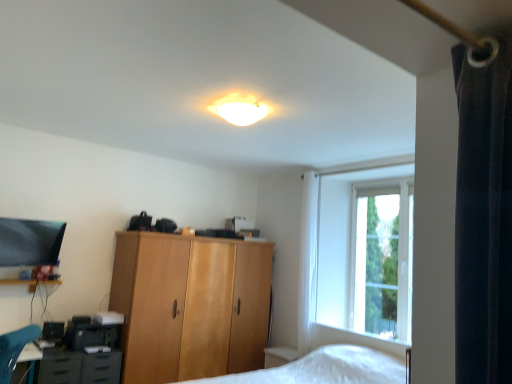
Question: Should I look upward or downward to see matte brown cabinet at lower left?

Choices:
 (A) down
 (B) up

Answer: (A)

Question: From the image's perspective, is matte black drawer at lower left on top of clear glass window at upper right?

Choices:
 (A) no
 (B) yes

Answer: (A)

Question: Is matte black drawer at lower left positioned behind clear glass window at upper right?

Choices:
 (A) no
 (B) yes

Answer: (A)

Question: Is matte black drawer at lower left closer to camera compared to clear glass window at upper right?

Choices:
 (A) no
 (B) yes

Answer: (B)

Question: Considering the relative sizes of matte black drawer at lower left and clear glass window at upper right in the image provided, is matte black drawer at lower left wider than clear glass window at upper right?

Choices:
 (A) no
 (B) yes

Answer: (B)

Question: Is clear glass window at upper right completely or partially inside matte black drawer at lower left?

Choices:
 (A) yes
 (B) no

Answer: (B)

Question: Is matte black drawer at lower left completely or partially outside of clear glass window at upper right?

Choices:
 (A) no
 (B) yes

Answer: (B)

Question: Is wooden cabinet at center at the left side of white fabric curtain at center?

Choices:
 (A) yes
 (B) no

Answer: (A)

Question: Is wooden cabinet at center outside of white fabric curtain at center?

Choices:
 (A) yes
 (B) no

Answer: (A)

Question: From the image's perspective, would you say wooden cabinet at center is positioned over white fabric curtain at center?

Choices:
 (A) yes
 (B) no

Answer: (B)

Question: From the image's perspective, is wooden cabinet at center beneath white fabric curtain at center?

Choices:
 (A) yes
 (B) no

Answer: (A)

Question: Is wooden cabinet at center taller than white fabric curtain at center?

Choices:
 (A) no
 (B) yes

Answer: (A)

Question: Is wooden cabinet at center smaller than white fabric curtain at center?

Choices:
 (A) yes
 (B) no

Answer: (B)

Question: From a real-world perspective, is white fabric curtain at center on top of matte brown cabinet at lower left?

Choices:
 (A) yes
 (B) no

Answer: (A)